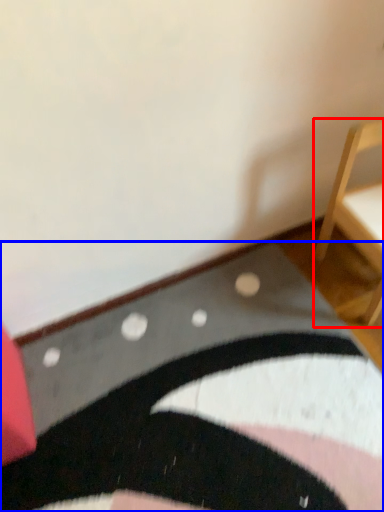
Question: Which of the following is the farthest to the observer, furniture (highlighted by a red box) or mat (highlighted by a blue box)?

Choices:
 (A) furniture
 (B) mat

Answer: (A)